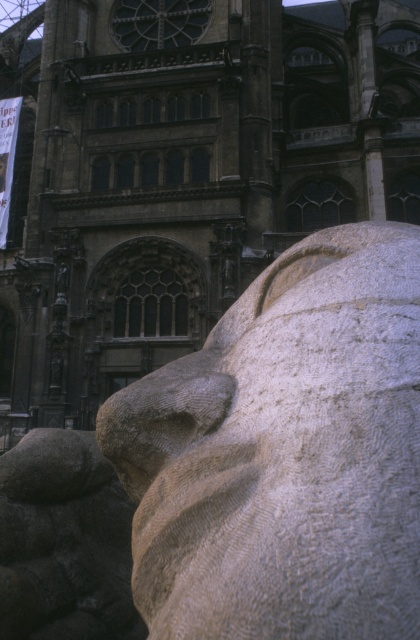
Which is more to the right, dark stone church at center or white stone lion at center?

From the viewer's perspective, white stone lion at center appears more on the right side.

Who is lower down, dark stone church at center or white stone lion at center?

white stone lion at center

Between point (84, 390) and point (134, 426), which one is positioned behind?

Positioned behind is point (84, 390).

Locate an element on the screen. The height and width of the screenshot is (640, 420). dark stone church at center is located at coordinates (183, 173).